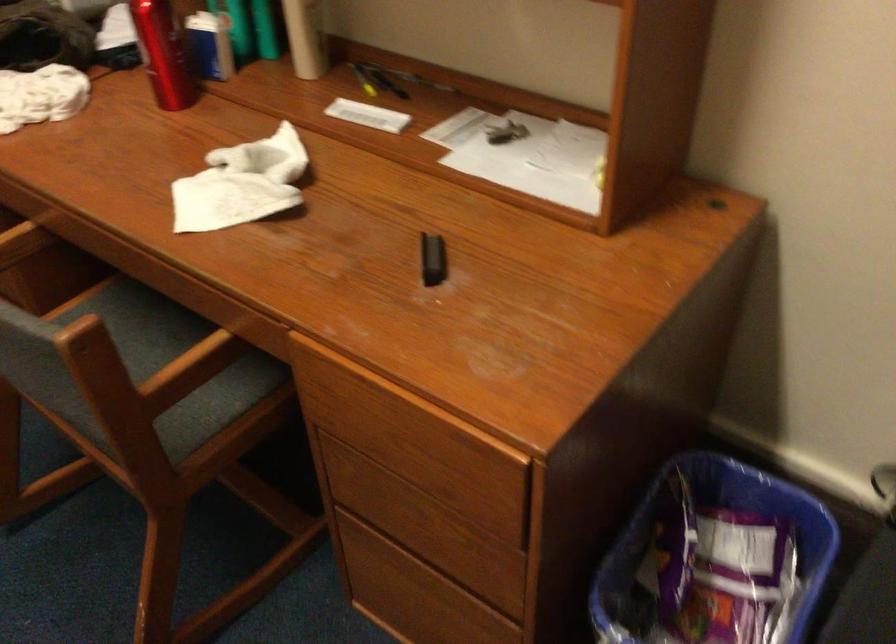
Where is `black pen cap`? This screenshot has width=896, height=644. black pen cap is located at coordinates (433, 259).